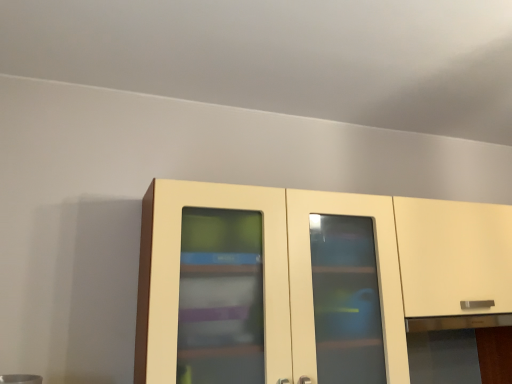
At what (x,y) coordinates should I click in order to perform the action: click on matte cream cupboard at center. Please return your answer as a coordinate pair (x, y). The width and height of the screenshot is (512, 384). Looking at the image, I should click on (308, 282).

Describe the element at coordinates (308, 282) in the screenshot. I see `matte cream cupboard at center` at that location.

I want to click on matte cream cupboard at center, so click(308, 282).